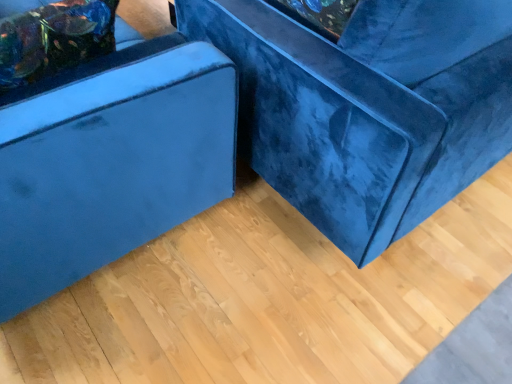
The width and height of the screenshot is (512, 384). Describe the element at coordinates (54, 39) in the screenshot. I see `velvet blue pillow at upper left` at that location.

At what (x,y) coordinates should I click in order to perform the action: click on velvet blue pillow at upper left. Please return your answer as a coordinate pair (x, y). The height and width of the screenshot is (384, 512). Looking at the image, I should click on (54, 39).

From a real-world perspective, which object stands above the other?

From a 3D spatial view, velvet blue pillow at upper left is above.

Is velvet blue couch at center, which ranks as the 1th furniture in right-to-left order, completely or partially inside velvet blue pillow at upper left?

No, velvet blue couch at center, which ranks as the 1th furniture in right-to-left order, is not inside velvet blue pillow at upper left.

Between point (84, 23) and point (197, 28), which one is positioned in front?

The point (84, 23) is closer.

From a real-world perspective, between velvet blue couch at center, which ranks as the 1th furniture in right-to-left order, and velvet blue ottoman at left, the second furniture in the right-to-left sequence, who is vertically lower?

velvet blue ottoman at left, the second furniture in the right-to-left sequence, from a real-world perspective.

Does velvet blue couch at center, the second furniture in the left-to-right sequence, have a larger size compared to velvet blue ottoman at left, the second furniture in the right-to-left sequence?

Correct, velvet blue couch at center, the second furniture in the left-to-right sequence, is larger in size than velvet blue ottoman at left, the second furniture in the right-to-left sequence.

Is velvet blue couch at center, the second furniture in the left-to-right sequence, not inside velvet blue ottoman at left, the second furniture in the right-to-left sequence?

Yes, velvet blue couch at center, the second furniture in the left-to-right sequence, is not within velvet blue ottoman at left, the second furniture in the right-to-left sequence.

Considering the relative sizes of velvet blue couch at center, which ranks as the 1th furniture in right-to-left order, and velvet blue ottoman at left, the second furniture in the right-to-left sequence, in the image provided, is velvet blue couch at center, which ranks as the 1th furniture in right-to-left order, taller than velvet blue ottoman at left, the second furniture in the right-to-left sequence,?

Indeed, velvet blue couch at center, which ranks as the 1th furniture in right-to-left order, has a greater height compared to velvet blue ottoman at left, the second furniture in the right-to-left sequence.

From the picture: Does velvet blue ottoman at left, the second furniture in the right-to-left sequence, have a lesser width compared to velvet blue pillow at upper left?

No, velvet blue ottoman at left, the second furniture in the right-to-left sequence, is not thinner than velvet blue pillow at upper left.

Which object is more forward, velvet blue ottoman at left, which ranks as the 1th furniture in left-to-right order, or velvet blue pillow at upper left?

velvet blue ottoman at left, which ranks as the 1th furniture in left-to-right order, is closer to the camera.

From a real-world perspective, relative to velvet blue pillow at upper left, is velvet blue ottoman at left, the second furniture in the right-to-left sequence, vertically above or below?

velvet blue ottoman at left, the second furniture in the right-to-left sequence, is below velvet blue pillow at upper left.

Does velvet blue ottoman at left, the second furniture in the right-to-left sequence, have a smaller size compared to velvet blue pillow at upper left?

Incorrect, velvet blue ottoman at left, the second furniture in the right-to-left sequence, is not smaller in size than velvet blue pillow at upper left.

Considering the positions of objects velvet blue pillow at upper left and velvet blue ottoman at left, the second furniture in the right-to-left sequence, in the image provided, who is more to the right, velvet blue pillow at upper left or velvet blue ottoman at left, the second furniture in the right-to-left sequence,?

Positioned to the right is velvet blue pillow at upper left.

Identify the location of pillow that is behind the velvet blue ottoman at left, which ranks as the 1th furniture in left-to-right order. Image resolution: width=512 pixels, height=384 pixels. (54, 39).

Looking at the image, does velvet blue pillow at upper left seem bigger or smaller compared to velvet blue ottoman at left, the second furniture in the right-to-left sequence?

Clearly, velvet blue pillow at upper left is smaller in size than velvet blue ottoman at left, the second furniture in the right-to-left sequence.

From the picture: Is velvet blue pillow at upper left outside of velvet blue ottoman at left, the second furniture in the right-to-left sequence?

No, most part of velvet blue pillow at upper left lies within velvet blue ottoman at left, the second furniture in the right-to-left sequence.

Which object is closer to the camera, velvet blue couch at center, which ranks as the 1th furniture in right-to-left order, or velvet blue pillow at upper left?

velvet blue couch at center, which ranks as the 1th furniture in right-to-left order, is closer to the camera.

In the image, there is a velvet blue couch at center, which ranks as the 1th furniture in right-to-left order. Where is `pillow below it (from the image's perspective)`? Image resolution: width=512 pixels, height=384 pixels. pillow below it (from the image's perspective) is located at coordinates (54, 39).

From a real-world perspective, which is physically below, velvet blue couch at center, which ranks as the 1th furniture in right-to-left order, or velvet blue pillow at upper left?

In real-world perspective, velvet blue couch at center, which ranks as the 1th furniture in right-to-left order, is lower.

This screenshot has width=512, height=384. There is a velvet blue ottoman at left, the second furniture in the right-to-left sequence. In order to click on furniture above it (from a real-world perspective) in this screenshot , I will do `click(367, 107)`.

Which is correct: velvet blue ottoman at left, which ranks as the 1th furniture in left-to-right order, is inside velvet blue couch at center, which ranks as the 1th furniture in right-to-left order, or outside of it?

velvet blue ottoman at left, which ranks as the 1th furniture in left-to-right order, is located beyond the bounds of velvet blue couch at center, which ranks as the 1th furniture in right-to-left order.

Looking at their sizes, would you say velvet blue ottoman at left, which ranks as the 1th furniture in left-to-right order, is wider or thinner than velvet blue couch at center, the second furniture in the left-to-right sequence?

Considering their sizes, velvet blue ottoman at left, which ranks as the 1th furniture in left-to-right order, looks slimmer than velvet blue couch at center, the second furniture in the left-to-right sequence.

Is velvet blue ottoman at left, the second furniture in the right-to-left sequence, not near velvet blue couch at center, the second furniture in the left-to-right sequence?

No.

From a real-world perspective, which furniture is the 1st one underneath the velvet blue pillow at upper left? Please provide its 2D coordinates.

[(367, 107)]

In order to click on furniture above the velvet blue ottoman at left, the second furniture in the right-to-left sequence (from a real-world perspective) in this screenshot , I will do `click(367, 107)`.

Considering their positions, is velvet blue couch at center, the second furniture in the left-to-right sequence, positioned further to velvet blue pillow at upper left than velvet blue ottoman at left, which ranks as the 1th furniture in left-to-right order?

→ velvet blue couch at center, the second furniture in the left-to-right sequence, is positioned further to the anchor velvet blue pillow at upper left.

When comparing their distances from velvet blue ottoman at left, which ranks as the 1th furniture in left-to-right order, does velvet blue couch at center, which ranks as the 1th furniture in right-to-left order, or velvet blue pillow at upper left seem closer?

velvet blue pillow at upper left.

Considering their positions, is velvet blue pillow at upper left positioned closer to velvet blue couch at center, the second furniture in the left-to-right sequence, than velvet blue ottoman at left, which ranks as the 1th furniture in left-to-right order?

velvet blue ottoman at left, which ranks as the 1th furniture in left-to-right order, lies closer to velvet blue couch at center, the second furniture in the left-to-right sequence, than the other object.

From the image, which object appears to be nearer to velvet blue pillow at upper left, velvet blue ottoman at left, the second furniture in the right-to-left sequence, or velvet blue couch at center, the second furniture in the left-to-right sequence?

velvet blue ottoman at left, the second furniture in the right-to-left sequence, lies closer to velvet blue pillow at upper left than the other object.

Considering their positions, is velvet blue ottoman at left, the second furniture in the right-to-left sequence, positioned closer to velvet blue couch at center, the second furniture in the left-to-right sequence, than velvet blue pillow at upper left?

The object closer to velvet blue couch at center, the second furniture in the left-to-right sequence, is velvet blue ottoman at left, the second furniture in the right-to-left sequence.

Looking at the image, which one is located further to velvet blue ottoman at left, the second furniture in the right-to-left sequence, velvet blue pillow at upper left or velvet blue couch at center, the second furniture in the left-to-right sequence?

velvet blue couch at center, the second furniture in the left-to-right sequence, lies further to velvet blue ottoman at left, the second furniture in the right-to-left sequence, than the other object.

Image resolution: width=512 pixels, height=384 pixels. I want to click on pillow between velvet blue ottoman at left, the second furniture in the right-to-left sequence, and velvet blue couch at center, which ranks as the 1th furniture in right-to-left order, from left to right, so click(x=54, y=39).